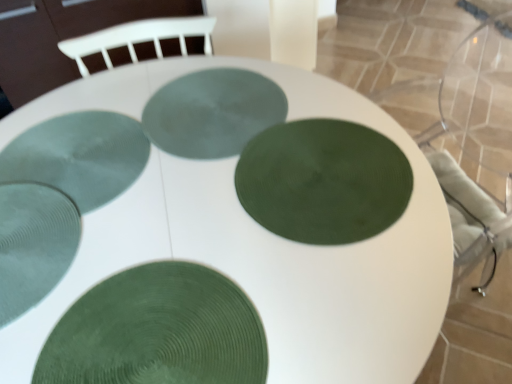
Locate an element on the screen. empty space that is to the right of clear textured glass at bottom left, the fourth glass plate from the back is located at coordinates (151, 240).